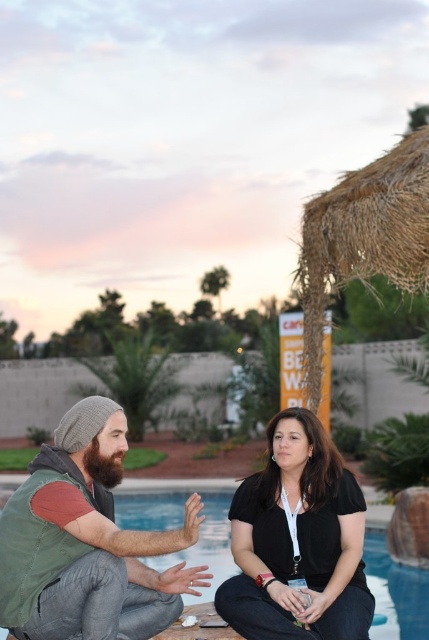
You are a fashion designer analyzing clothing sizes in the image. The green textured vest at center and the black matte shirt at center are both worn by the same person. Which clothing item appears to be more oversized?

The green textured vest at center has a larger size compared to the black matte shirt at center, so the green textured vest at center appears more oversized.

You are designing a new clothing line and want to ensure that the green textured vest at center and the black matte shirt at center can be worn together. Based on their sizes, which one should be placed higher in the outfit to maintain balance?

The green textured vest at center has a greater height compared to the black matte shirt at center, so to maintain balance, the black matte shirt at center should be placed higher in the outfit to compensate for its shorter height.

You are designing a new coat rack and need to know the relative widths of the green textured vest at center and the black matte shirt at center. Based on the scene, which item is wider?

The green textured vest at center is wider than the black matte shirt at center according to the description.